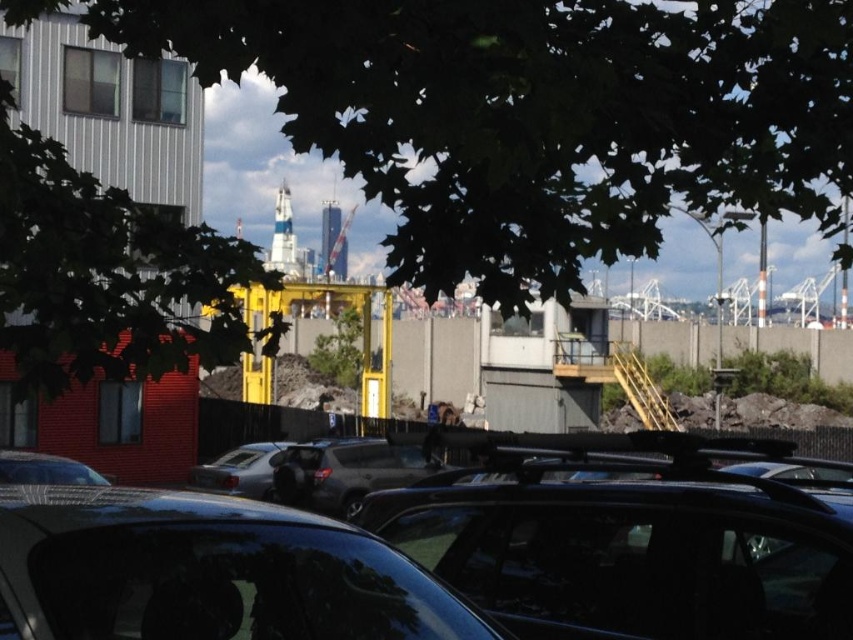
Question: Which object appears farthest from the camera in this image?

Choices:
 (A) satin silver car at center
 (B) glossy black car at center
 (C) matte black car at lower left

Answer: (A)

Question: Observing the image, what is the correct spatial positioning of green leafy tree at upper center in reference to glossy black car at lower center?

Choices:
 (A) below
 (B) above

Answer: (B)

Question: Among these points, which one is farthest from the camera?

Choices:
 (A) (547, 134)
 (B) (33, 208)
 (C) (91, 483)
 (D) (527, 528)

Answer: (C)

Question: Does glossy black car at lower center have a greater width compared to satin silver car at center?

Choices:
 (A) yes
 (B) no

Answer: (B)

Question: Which of the following is the closest to the observer?

Choices:
 (A) (693, 209)
 (B) (189, 486)
 (C) (67, 380)

Answer: (C)

Question: Is green leafy tree at upper left behind satin silver car at center?

Choices:
 (A) yes
 (B) no

Answer: (B)